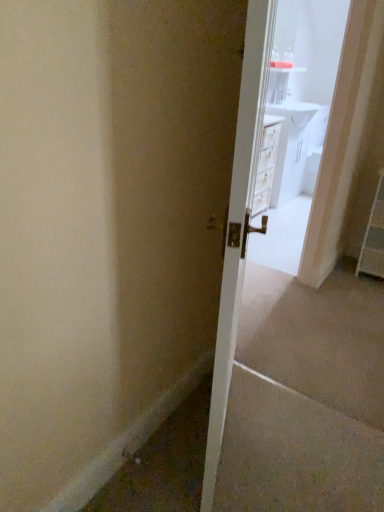
Question: From a real-world perspective, is white glossy door at center physically above white plastic dresser at right?

Choices:
 (A) no
 (B) yes

Answer: (B)

Question: Is white glossy door at center located outside white plastic dresser at right?

Choices:
 (A) yes
 (B) no

Answer: (A)

Question: Is white glossy door at center smaller than white plastic dresser at right?

Choices:
 (A) yes
 (B) no

Answer: (B)

Question: Can you confirm if white glossy door at center is wider than white plastic dresser at right?

Choices:
 (A) yes
 (B) no

Answer: (B)

Question: Considering the relative positions of white glossy door at center and white plastic dresser at right in the image provided, is white glossy door at center in front of white plastic dresser at right?

Choices:
 (A) no
 (B) yes

Answer: (B)

Question: Is white plastic dresser at right completely or partially inside white glossy door at center?

Choices:
 (A) no
 (B) yes

Answer: (A)

Question: Is white glossy vanity at upper center further to camera compared to white plastic dresser at right?

Choices:
 (A) no
 (B) yes

Answer: (B)

Question: Is white glossy vanity at upper center turned away from white plastic dresser at right?

Choices:
 (A) no
 (B) yes

Answer: (A)

Question: Does white glossy vanity at upper center appear on the right side of white plastic dresser at right?

Choices:
 (A) yes
 (B) no

Answer: (B)

Question: Is white glossy vanity at upper center positioned before white plastic dresser at right?

Choices:
 (A) no
 (B) yes

Answer: (A)

Question: From the image's perspective, is white glossy vanity at upper center below white plastic dresser at right?

Choices:
 (A) yes
 (B) no

Answer: (B)

Question: Is white glossy vanity at upper center outside of white plastic dresser at right?

Choices:
 (A) yes
 (B) no

Answer: (A)

Question: Does white glossy door at center have a larger size compared to white glossy vanity at upper center?

Choices:
 (A) no
 (B) yes

Answer: (B)